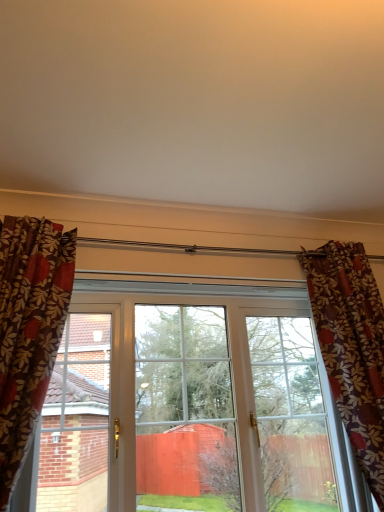
Describe the element at coordinates (351, 347) in the screenshot. I see `floral fabric curtain at right` at that location.

Measure the distance between floral fabric curtain at right and camera.

floral fabric curtain at right and camera are 1.82 meters apart from each other.

What is the approximate height of floral fabric curtain at right?

It is 1.25 meters.

Where is `floral fabric curtain at right`? The width and height of the screenshot is (384, 512). floral fabric curtain at right is located at coordinates (351, 347).

The height and width of the screenshot is (512, 384). In order to click on white plastic window at center in this screenshot , I will do `click(191, 403)`.

What do you see at coordinates (191, 403) in the screenshot?
I see `white plastic window at center` at bounding box center [191, 403].

You are a GUI agent. You are given a task and a screenshot of the screen. Output one action in this format:
    pyautogui.click(x=<x>, y=<y>)
    Task: Click on the floral fabric curtain at right
    Image resolution: width=384 pixels, height=512 pixels.
    Given the screenshot: What is the action you would take?
    pyautogui.click(x=351, y=347)

Considering the relative positions of floral fabric curtain at right and white plastic window at center in the image provided, is floral fabric curtain at right to the left of white plastic window at center from the viewer's perspective?

Incorrect, floral fabric curtain at right is not on the left side of white plastic window at center.

Is the depth of floral fabric curtain at right less than that of white plastic window at center?

Yes.

Is point (320, 269) in front of point (186, 333)?

Yes, point (320, 269) is closer to viewer.

From the image's perspective, is floral fabric curtain at right located above or below white plastic window at center?

floral fabric curtain at right is above white plastic window at center.

From a real-world perspective, which is physically below, floral fabric curtain at right or white plastic window at center?

white plastic window at center is physically lower.

Can you confirm if floral fabric curtain at right is wider than white plastic window at center?

Yes, floral fabric curtain at right is wider than white plastic window at center.

Is floral fabric curtain at right shorter than white plastic window at center?

In fact, floral fabric curtain at right may be taller than white plastic window at center.

Considering the sizes of floral fabric curtain at right and white plastic window at center in the image, is floral fabric curtain at right bigger or smaller than white plastic window at center?

Considering their sizes, floral fabric curtain at right takes up more space than white plastic window at center.

Is white plastic window at center surrounded by floral fabric curtain at right?

No, white plastic window at center is not inside floral fabric curtain at right.

Is floral fabric curtain at right next to white plastic window at center?

No, floral fabric curtain at right is not with white plastic window at center.

Does floral fabric curtain at right turn towards white plastic window at center?

No.

How many degrees apart are the facing directions of floral fabric curtain at right and white plastic window at center?

There is a 0.113-degree angle between the facing directions of floral fabric curtain at right and white plastic window at center.

The image size is (384, 512). Identify the location of curtain in front of the white plastic window at center. (351, 347).

Considering the positions of objects white plastic window at center and floral fabric curtain at right in the image provided, who is more to the right, white plastic window at center or floral fabric curtain at right?

Positioned to the right is floral fabric curtain at right.

Does white plastic window at center come behind floral fabric curtain at right?

Yes.

Which is closer, (55, 454) or (308, 283)?

Clearly, point (55, 454) is closer to the camera than point (308, 283).

From the image's perspective, is white plastic window at center on top of floral fabric curtain at right?

No, from the image's perspective, white plastic window at center is not on top of floral fabric curtain at right.

Consider the image. From a real-world perspective, which object stands above the other?

In real-world perspective, floral fabric curtain at right is above.

In terms of width, does white plastic window at center look wider or thinner when compared to floral fabric curtain at right?

Clearly, white plastic window at center has less width compared to floral fabric curtain at right.

Considering the sizes of white plastic window at center and floral fabric curtain at right in the image, is white plastic window at center taller or shorter than floral fabric curtain at right?

Considering their sizes, white plastic window at center has less height than floral fabric curtain at right.

Does white plastic window at center have a smaller size compared to floral fabric curtain at right?

Indeed, white plastic window at center has a smaller size compared to floral fabric curtain at right.

Is white plastic window at center inside or outside of floral fabric curtain at right?

white plastic window at center is spatially situated outside floral fabric curtain at right.

Would you say white plastic window at center is a long distance from floral fabric curtain at right?

Actually, white plastic window at center and floral fabric curtain at right are a little close together.

Consider the image. Is white plastic window at center facing away from floral fabric curtain at right?

No, floral fabric curtain at right is not at the back of white plastic window at center.

How many degrees apart are the facing directions of white plastic window at center and floral fabric curtain at right?

white plastic window at center and floral fabric curtain at right are facing 0.113 degrees away from each other.

This screenshot has width=384, height=512. I want to click on curtain on the right of white plastic window at center, so click(x=351, y=347).

Find the location of a particular element. This screenshot has width=384, height=512. window behind the floral fabric curtain at right is located at coordinates (191, 403).

The image size is (384, 512). I want to click on window below the floral fabric curtain at right (from the image's perspective), so click(191, 403).